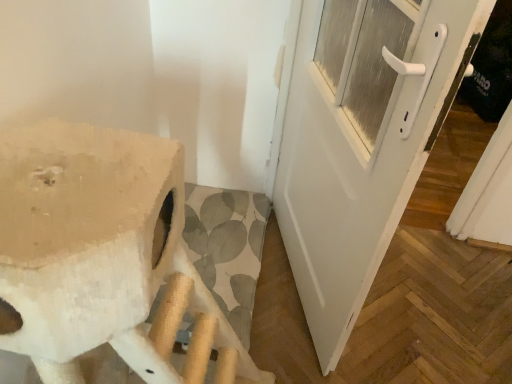
This screenshot has width=512, height=384. What are the coordinates of `white matte door at center` in the screenshot? It's located at (362, 141).

What do you see at coordinates (362, 141) in the screenshot? The height and width of the screenshot is (384, 512). I see `white matte door at center` at bounding box center [362, 141].

This screenshot has height=384, width=512. I want to click on white matte door at center, so click(x=362, y=141).